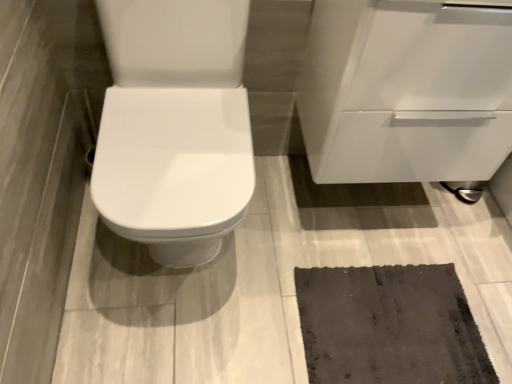
I want to click on vacant space in white glossy cabinet at upper right (from a real-world perspective), so click(359, 201).